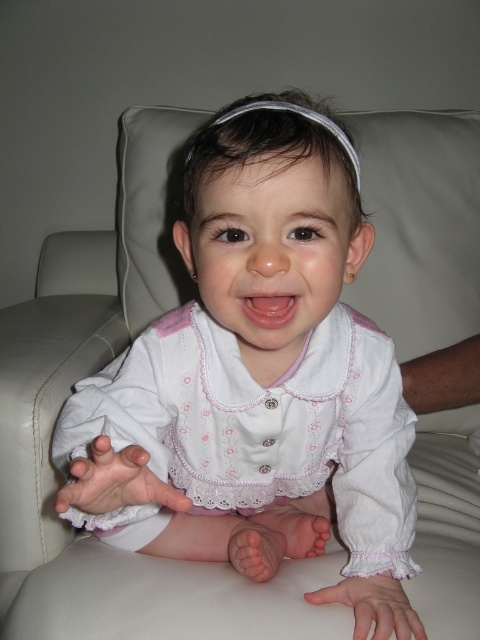
Can you confirm if white lace hand at lower left is shorter than white fabric headband at upper center?

In fact, white lace hand at lower left may be taller than white fabric headband at upper center.

Does point (108, 442) come in front of point (360, 173)?

Yes, it is.

Does point (177, 502) come behind point (224, 115)?

No.

Identify the location of white lace hand at lower left. Image resolution: width=480 pixels, height=640 pixels. (116, 481).

Is point (383, 596) less distant than point (279, 100)?

No, it is not.

Which is behind, point (396, 593) or point (302, 106)?

The point (396, 593) is behind.

Identify the location of white lace hand at lower center. 373,605.

Is white lace hand at lower left further to the viewer compared to white lace hand at lower center?

No, it is in front of white lace hand at lower center.

Is white lace hand at lower left in front of white lace hand at lower center?

Yes, it is.

Between point (127, 458) and point (387, 618), which one is positioned behind?

Positioned behind is point (387, 618).

Where is `white lace hand at lower left`? white lace hand at lower left is located at coordinates (116, 481).